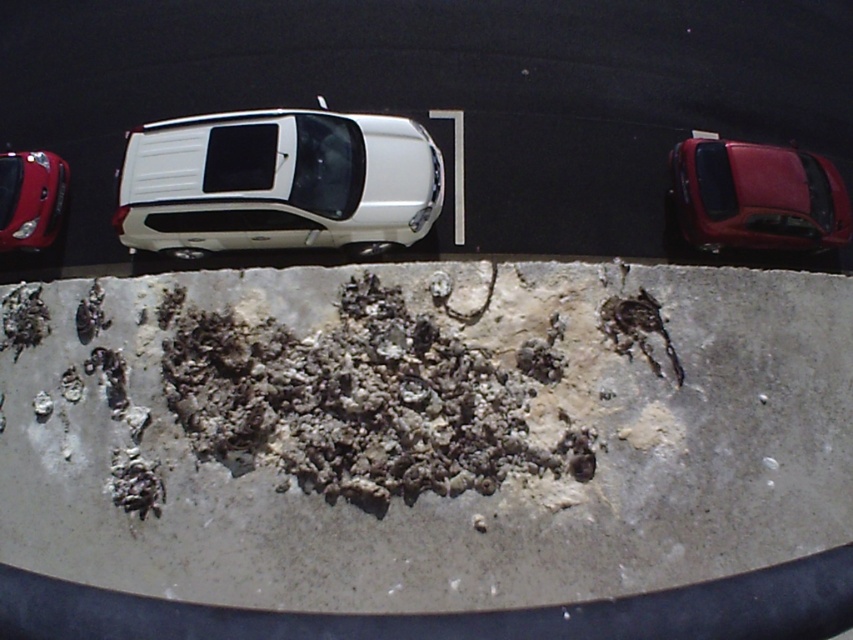
Is glossy red car at right smaller than shiny red car at left?

Incorrect, glossy red car at right is not smaller in size than shiny red car at left.

Does glossy red car at right have a lesser width compared to shiny red car at left?

In fact, glossy red car at right might be wider than shiny red car at left.

Identify the location of glossy red car at right. The height and width of the screenshot is (640, 853). (753, 196).

Where is `glossy red car at right`? glossy red car at right is located at coordinates (753, 196).

Does gray rough concrete at center appear on the left side of shiny red car at left?

In fact, gray rough concrete at center is to the right of shiny red car at left.

Who is positioned more to the right, gray rough concrete at center or shiny red car at left?

Positioned to the right is gray rough concrete at center.

Does point (61, 372) come behind point (9, 202)?

No.

Locate an element on the screen. This screenshot has width=853, height=640. gray rough concrete at center is located at coordinates (431, 458).

Is white matte truck at center below shiny red car at left?

Yes.

Can you confirm if white matte truck at center is wider than shiny red car at left?

Yes, white matte truck at center is wider than shiny red car at left.

Between point (163, 240) and point (38, 188), which one is positioned in front?

Point (163, 240) is in front.

Find the location of a particular element. The height and width of the screenshot is (640, 853). white matte truck at center is located at coordinates (277, 182).